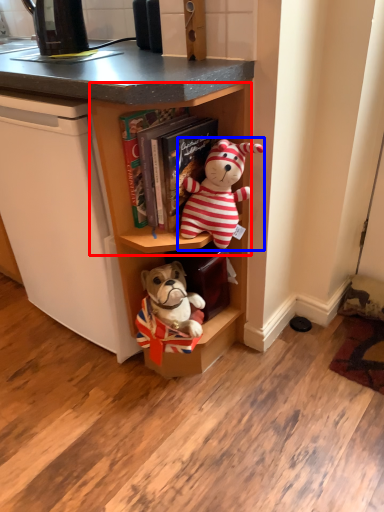
Question: Among these objects, which one is farthest to the camera, cabinet (highlighted by a red box) or toy (highlighted by a blue box)?

Choices:
 (A) cabinet
 (B) toy

Answer: (B)